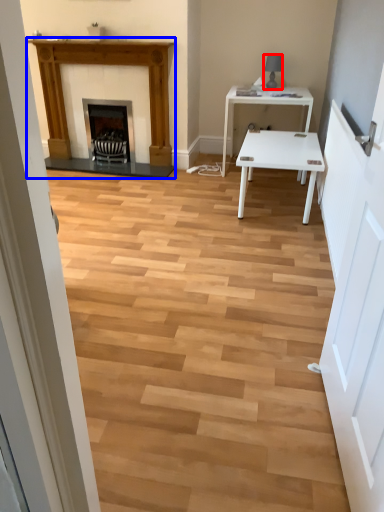
Question: Among these objects, which one is nearest to the camera, lamp (highlighted by a red box) or fireplace (highlighted by a blue box)?

Choices:
 (A) lamp
 (B) fireplace

Answer: (B)